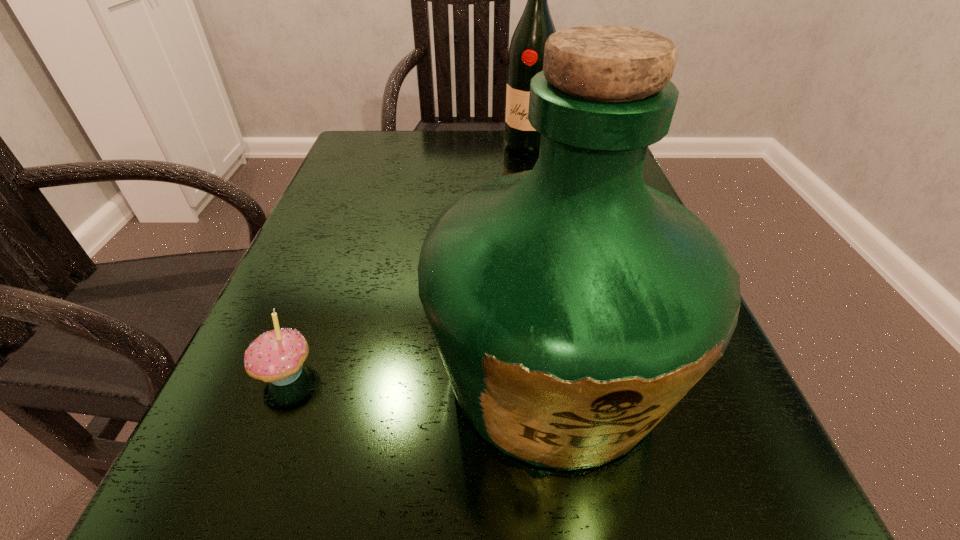
Locate an element on the screen. object that is at the near right corner is located at coordinates (573, 306).

This screenshot has height=540, width=960. Find the location of `vacant area at the left edge of the desktop`. vacant area at the left edge of the desktop is located at coordinates (348, 263).

Where is `vacant space at the far left corner of the desktop`? This screenshot has height=540, width=960. vacant space at the far left corner of the desktop is located at coordinates click(395, 173).

This screenshot has height=540, width=960. I want to click on vacant space at the near left corner of the desktop, so click(x=180, y=525).

The image size is (960, 540). In order to click on empty location between the farthest object and the cupcake in this screenshot , I will do `click(406, 259)`.

The height and width of the screenshot is (540, 960). I want to click on free space between the shortest object and the farther liquor, so click(406, 259).

Find the location of `free spot between the nearer liquor and the cupcake`. free spot between the nearer liquor and the cupcake is located at coordinates (420, 372).

Identify the location of vacant space in between the cupcake and the farthest object. The image size is (960, 540). (406, 259).

What are the coordinates of `free spot between the farther liquor and the leftmost object` in the screenshot? It's located at (406, 259).

This screenshot has height=540, width=960. I want to click on vacant point located between the farthest object and the shortest object, so point(406,259).